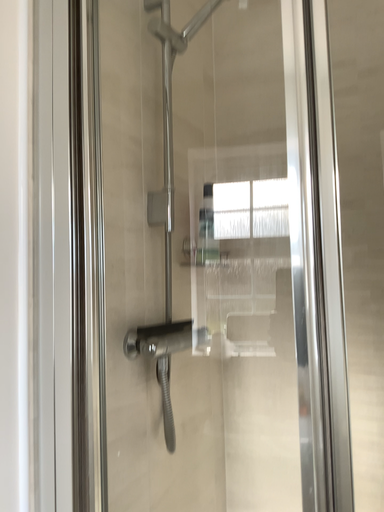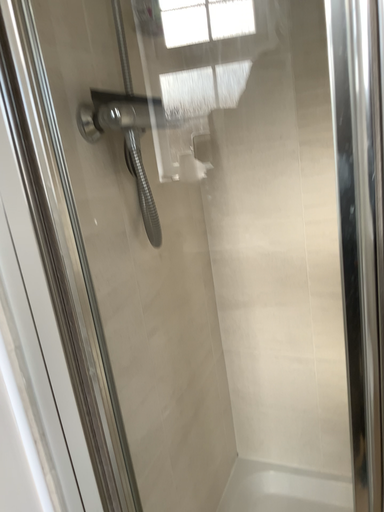
Question: Which way did the camera rotate in the video?

Choices:
 (A) rotated upward
 (B) rotated downward

Answer: (B)